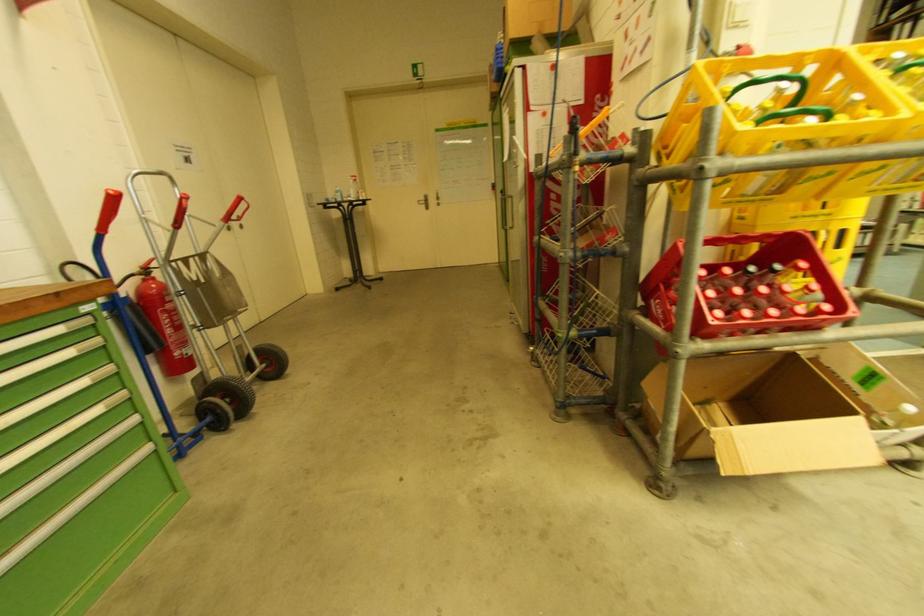
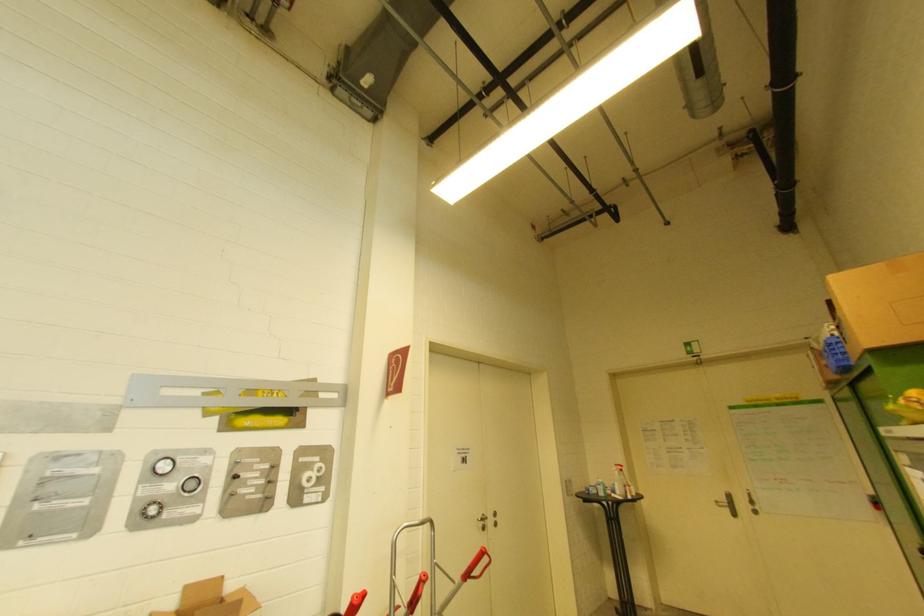
Find the pixel in the second image that matches pixel 186 198 in the first image.

(426, 578)